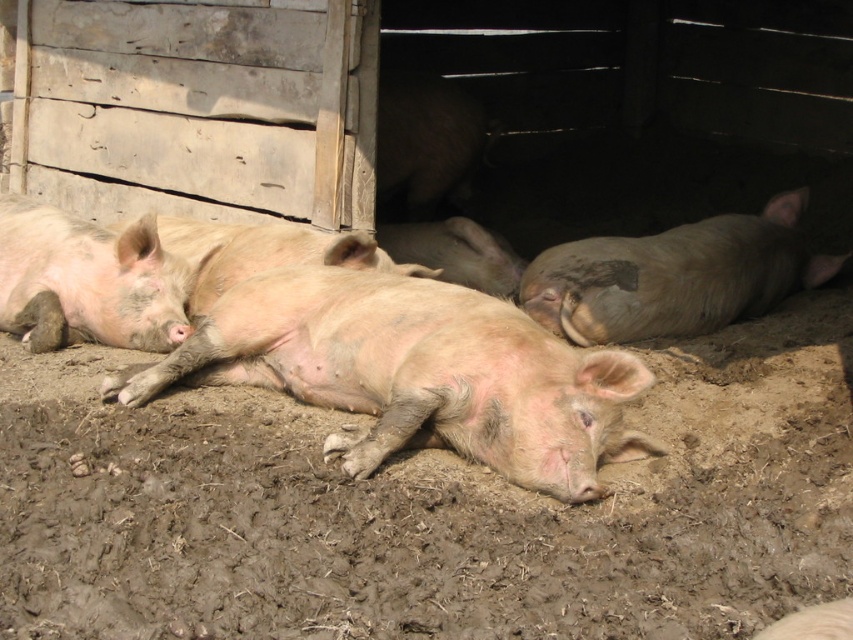
Which is more to the left, gray matte pig at right or pink matte/skinny pig at left?

From the viewer's perspective, pink matte/skinny pig at left appears more on the left side.

From the picture: Does gray matte pig at right have a greater width compared to pink matte/skinny pig at left?

Yes.

Describe the element at coordinates (674, 276) in the screenshot. I see `gray matte pig at right` at that location.

Where is `gray matte pig at right`? gray matte pig at right is located at coordinates 674,276.

Does point (509, 451) come farther from viewer compared to point (80, 316)?

No, (509, 451) is closer to viewer.

Is pink muddy pig at center positioned behind pink matte/skinny pig at left?

No, pink muddy pig at center is in front of pink matte/skinny pig at left.

Where is `pink muddy pig at center`? pink muddy pig at center is located at coordinates (415, 372).

Which is more to the left, pink muddy pig at center or gray matte pig at right?

From the viewer's perspective, pink muddy pig at center appears more on the left side.

Is point (531, 376) behind point (598, 300)?

No.

Image resolution: width=853 pixels, height=640 pixels. Find the location of `pink muddy pig at center`. pink muddy pig at center is located at coordinates (415, 372).